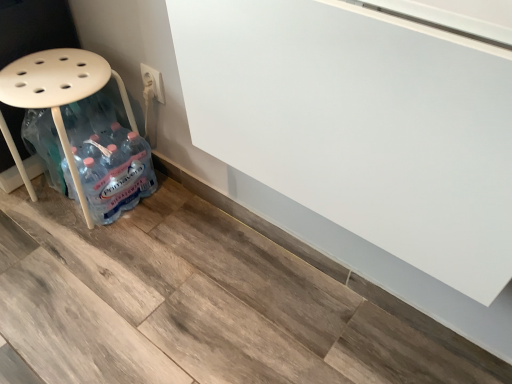
Describe the element at coordinates (153, 81) in the screenshot. Image resolution: width=512 pixels, height=384 pixels. I see `white plastic electric outlet at upper center` at that location.

This screenshot has width=512, height=384. In order to click on white plastic electric outlet at upper center in this screenshot , I will do `click(153, 81)`.

At what (x,y) coordinates should I click in order to perform the action: click on white plastic stool at left. Please return your answer as a coordinate pair (x, y). Looking at the image, I should click on (83, 129).

The image size is (512, 384). Describe the element at coordinates (83, 129) in the screenshot. I see `white plastic stool at left` at that location.

Where is `white plastic electric outlet at upper center`? white plastic electric outlet at upper center is located at coordinates (153, 81).

Does white plastic electric outlet at upper center appear on the right side of white plastic stool at left?

Yes.

Is the position of white plastic electric outlet at upper center more distant than that of white plastic stool at left?

Yes, the depth of white plastic electric outlet at upper center is greater than that of white plastic stool at left.

Is point (156, 89) closer to viewer compared to point (14, 97)?

No, (156, 89) is further to viewer.

From the image's perspective, which is below, white plastic electric outlet at upper center or white plastic stool at left?

white plastic stool at left.

From a real-world perspective, who is located higher, white plastic electric outlet at upper center or white plastic stool at left?

white plastic electric outlet at upper center, from a real-world perspective.

Considering the relative sizes of white plastic electric outlet at upper center and white plastic stool at left in the image provided, is white plastic electric outlet at upper center wider than white plastic stool at left?

Answer: Incorrect, the width of white plastic electric outlet at upper center does not surpass that of white plastic stool at left.

Looking at this image, from their relative heights in the image, would you say white plastic electric outlet at upper center is taller or shorter than white plastic stool at left?

Considering their sizes, white plastic electric outlet at upper center has less height than white plastic stool at left.

Considering the relative sizes of white plastic electric outlet at upper center and white plastic stool at left in the image provided, is white plastic electric outlet at upper center smaller than white plastic stool at left?

Correct, white plastic electric outlet at upper center occupies less space than white plastic stool at left.

Is white plastic electric outlet at upper center positioned beyond the bounds of white plastic stool at left?

Yes.

Is white plastic electric outlet at upper center touching white plastic stool at left?

They are not placed beside each other.

Is white plastic electric outlet at upper center oriented away from white plastic stool at left?

white plastic electric outlet at upper center is not turned away from white plastic stool at left.

At what (x,y) coordinates should I click in order to perform the action: click on furniture that is under the white plastic electric outlet at upper center (from a real-world perspective). Please return your answer as a coordinate pair (x, y). Looking at the image, I should click on (83, 129).

Which object is positioned more to the left, white plastic stool at left or white plastic electric outlet at upper center?

white plastic stool at left is more to the left.

Considering the positions of objects white plastic stool at left and white plastic electric outlet at upper center in the image provided, who is in front, white plastic stool at left or white plastic electric outlet at upper center?

white plastic stool at left.

From the picture: Which is closer, (39, 71) or (163, 88)?

Point (39, 71) is closer to the camera than point (163, 88).

From the image's perspective, is white plastic stool at left on white plastic electric outlet at upper center?

Incorrect, from the image's perspective, white plastic stool at left is lower than white plastic electric outlet at upper center.

From a real-world perspective, which object rests below the other?

white plastic stool at left.

In terms of width, does white plastic stool at left look wider or thinner when compared to white plastic electric outlet at upper center?

Clearly, white plastic stool at left has more width compared to white plastic electric outlet at upper center.

Considering the relative sizes of white plastic stool at left and white plastic electric outlet at upper center in the image provided, is white plastic stool at left taller than white plastic electric outlet at upper center?

Yes, white plastic stool at left is taller than white plastic electric outlet at upper center.

Which of these two, white plastic stool at left or white plastic electric outlet at upper center, is bigger?

white plastic stool at left is bigger.

Is white plastic stool at left outside of white plastic electric outlet at upper center?

Yes, white plastic stool at left is outside of white plastic electric outlet at upper center.

Would you consider white plastic stool at left to be distant from white plastic electric outlet at upper center?

No.

Is white plastic stool at left looking in the opposite direction of white plastic electric outlet at upper center?

Yes, white plastic stool at left's orientation is away from white plastic electric outlet at upper center.

How many degrees apart are the facing directions of white plastic stool at left and white plastic electric outlet at upper center?

white plastic stool at left and white plastic electric outlet at upper center are facing 4.22 degrees away from each other.

This screenshot has width=512, height=384. What are the coordinates of `furniture in front of the white plastic electric outlet at upper center` in the screenshot? It's located at (83, 129).

The image size is (512, 384). In order to click on furniture in front of the white plastic electric outlet at upper center in this screenshot , I will do `click(83, 129)`.

Locate an element on the screen. furniture that appears below the white plastic electric outlet at upper center (from the image's perspective) is located at coordinates (83, 129).